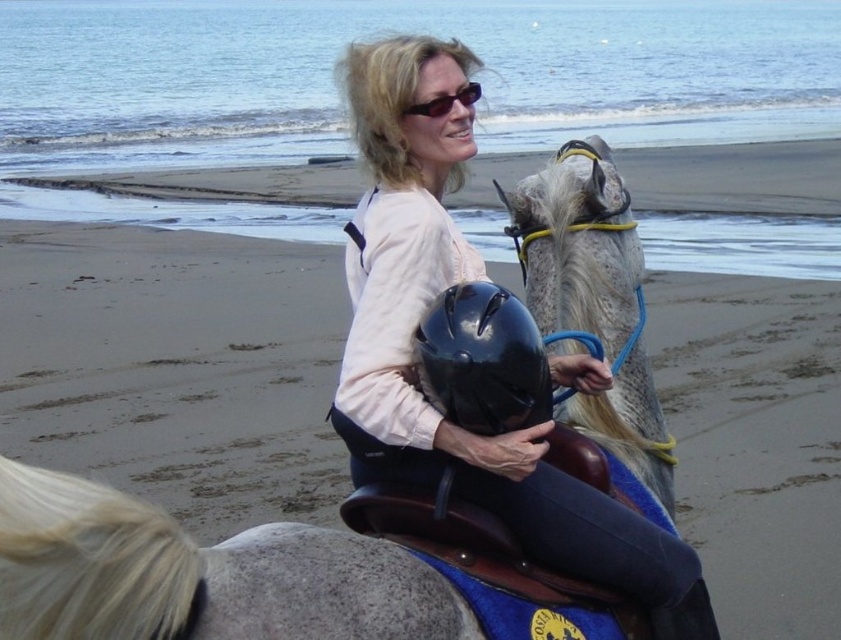
You are a photographer taking a picture of the rider. You notice the matte black helmet at center and the black plastic sunglasses at upper center. Which object should you zoom in on to capture more details of the wider object?

The matte black helmet at center is wider than the black plastic sunglasses at upper center, so you should zoom in on the matte black helmet at center to capture more details of the wider object.

You are standing on the beach and see two points marked on the sand. The first point is at coordinate point[445,440] and the second point is at coordinate point[469,371]. Which point is closer to you?

Point[445,440] is further to the camera than point[469,371], so the point at point[469,371] is closer to you.